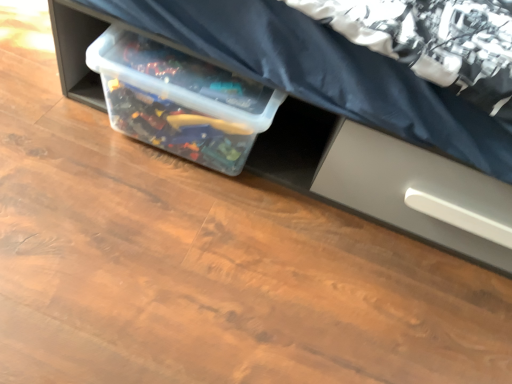
Question: Considering the positions of point (251, 87) and point (294, 120), is point (251, 87) closer or farther from the camera than point (294, 120)?

Choices:
 (A) closer
 (B) farther

Answer: (A)

Question: Looking at their shapes, would you say transparent plastic container at center is wider or thinner than clear plastic storage bin at center?

Choices:
 (A) wide
 (B) thin

Answer: (B)

Question: Based on their relative distances, which object is nearer to the clear plastic storage bin at center?

Choices:
 (A) satin gray drawer at lower right
 (B) transparent plastic container at center

Answer: (A)

Question: Which is farther from the clear plastic storage bin at center?

Choices:
 (A) transparent plastic container at center
 (B) satin gray drawer at lower right

Answer: (A)